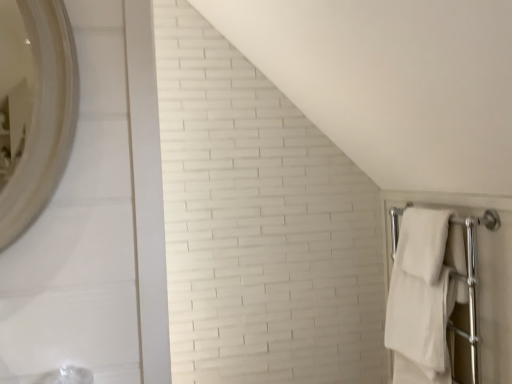
Question: Is white soft towel at right, which is the first bath towel in top-to-bottom order, taller or shorter than white soft towel at right, which is the first bath towel in bottom-to-top order?

Choices:
 (A) short
 (B) tall

Answer: (A)

Question: Is white soft towel at right, the 2th bath towel in the bottom-to-top sequence, wider or thinner than white soft towel at right, which appears as the 2th bath towel when viewed from the top?

Choices:
 (A) thin
 (B) wide

Answer: (A)

Question: Is white soft towel at right, which is the first bath towel in top-to-bottom order, situated inside white soft towel at right, which is the first bath towel in bottom-to-top order, or outside?

Choices:
 (A) inside
 (B) outside

Answer: (B)

Question: Is white soft towel at right, which is the first bath towel in bottom-to-top order, bigger or smaller than white soft towel at right, which is the first bath towel in top-to-bottom order?

Choices:
 (A) big
 (B) small

Answer: (A)

Question: Considering the positions of white soft towel at right, which is the first bath towel in bottom-to-top order, and white soft towel at right, which is the first bath towel in top-to-bottom order, in the image, is white soft towel at right, which is the first bath towel in bottom-to-top order, wider or thinner than white soft towel at right, which is the first bath towel in top-to-bottom order,?

Choices:
 (A) thin
 (B) wide

Answer: (B)

Question: Considering the positions of white soft towel at right, which is the first bath towel in bottom-to-top order, and white soft towel at right, which is the first bath towel in top-to-bottom order, in the image, is white soft towel at right, which is the first bath towel in bottom-to-top order, taller or shorter than white soft towel at right, which is the first bath towel in top-to-bottom order,?

Choices:
 (A) tall
 (B) short

Answer: (A)

Question: From a real-world perspective, is white soft towel at right, which appears as the 2th bath towel when viewed from the top, physically located above or below white soft towel at right, which is the first bath towel in top-to-bottom order?

Choices:
 (A) below
 (B) above

Answer: (A)